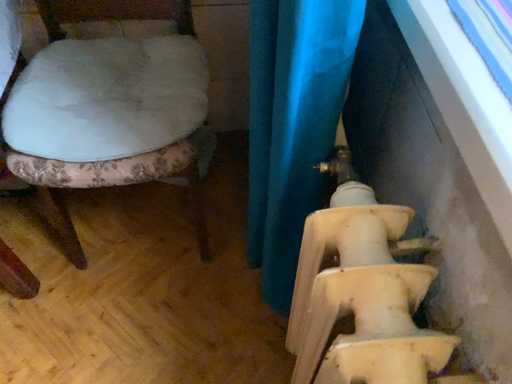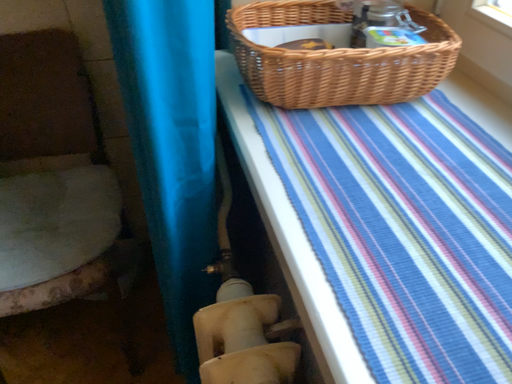
Question: Which way did the camera rotate in the video?

Choices:
 (A) rotated upward
 (B) rotated downward

Answer: (A)